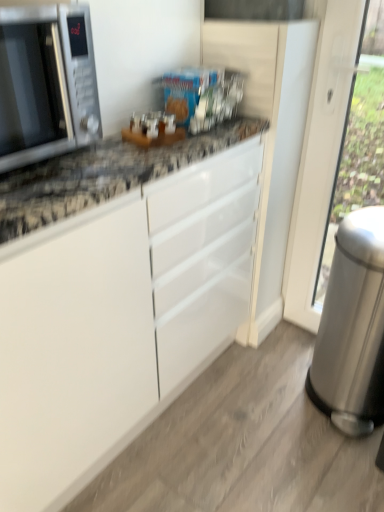
What are the coordinates of `vacant space positioned to the left of silver metallic trash can at right` in the screenshot? It's located at (258, 396).